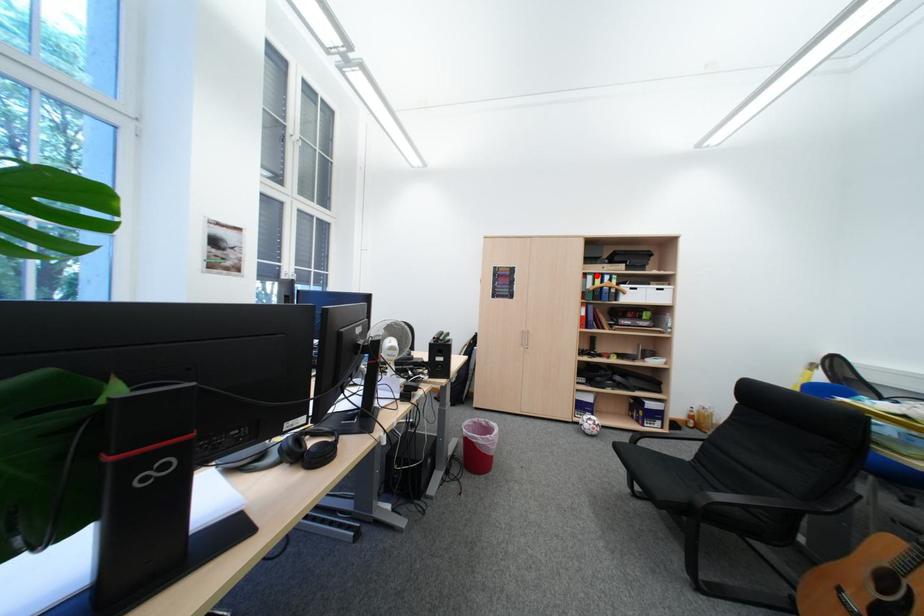
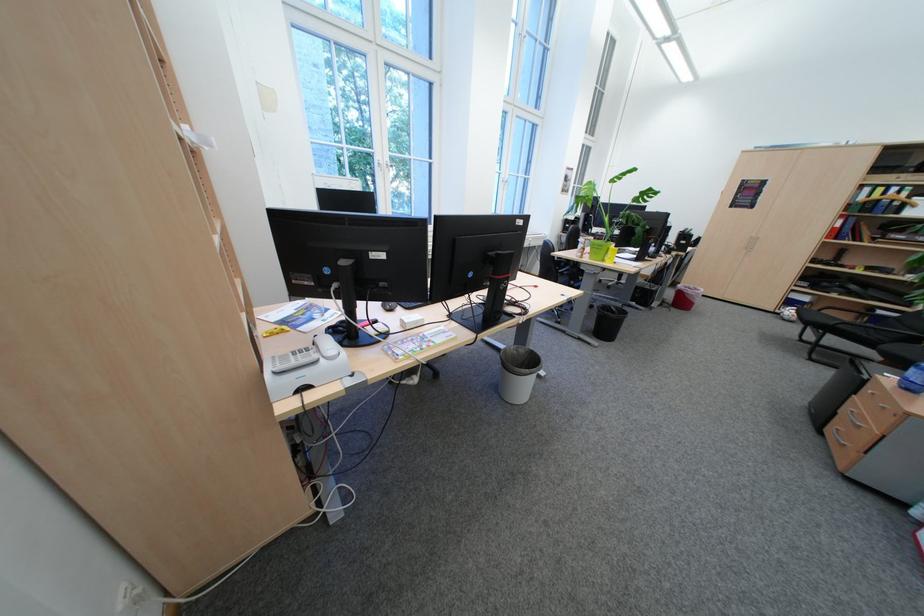
In the second image, find the point that corresponds to the highlighted location in the first image.

(873, 188)